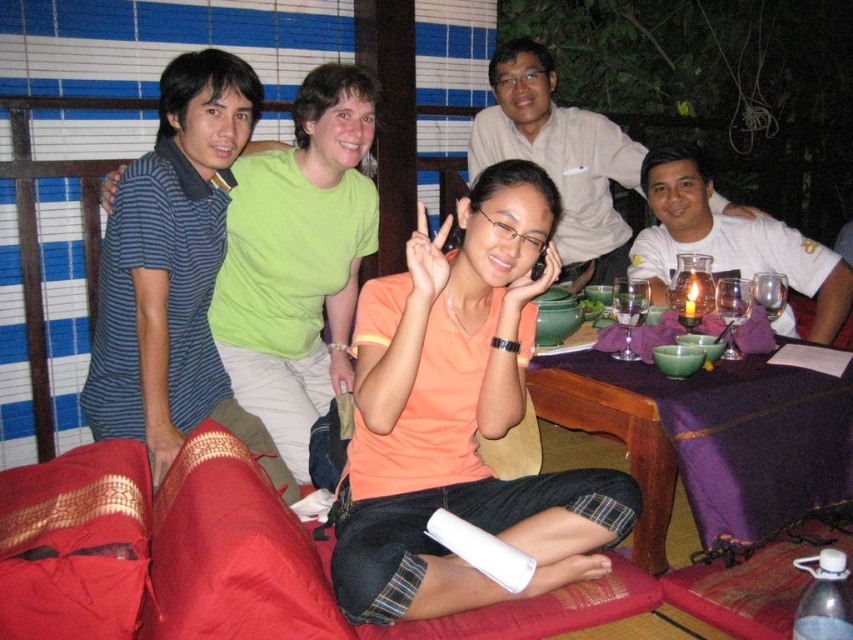
Question: Can you confirm if purple fabric dining table at center is positioned above white cotton shirt at upper center?

Choices:
 (A) yes
 (B) no

Answer: (B)

Question: Which of these objects is positioned farthest from the orange matte shirt at center?

Choices:
 (A) purple fabric dining table at center
 (B) white matte shirt at upper right
 (C) white cotton shirt at upper center

Answer: (C)

Question: Which is nearer to the white matte shirt at upper right?

Choices:
 (A) orange matte shirt at center
 (B) purple fabric dining table at center
 (C) blue striped polo shirt at left
 (D) white cotton shirt at upper center

Answer: (B)

Question: Does purple fabric dining table at center have a larger size compared to white matte shirt at upper right?

Choices:
 (A) yes
 (B) no

Answer: (A)

Question: Which object is closer to the camera taking this photo?

Choices:
 (A) purple fabric dining table at center
 (B) white cotton shirt at upper center
 (C) orange matte shirt at center
 (D) blue striped polo shirt at left

Answer: (C)

Question: From the image, what is the correct spatial relationship of purple fabric dining table at center in relation to white matte shirt at upper right?

Choices:
 (A) right
 (B) left

Answer: (B)